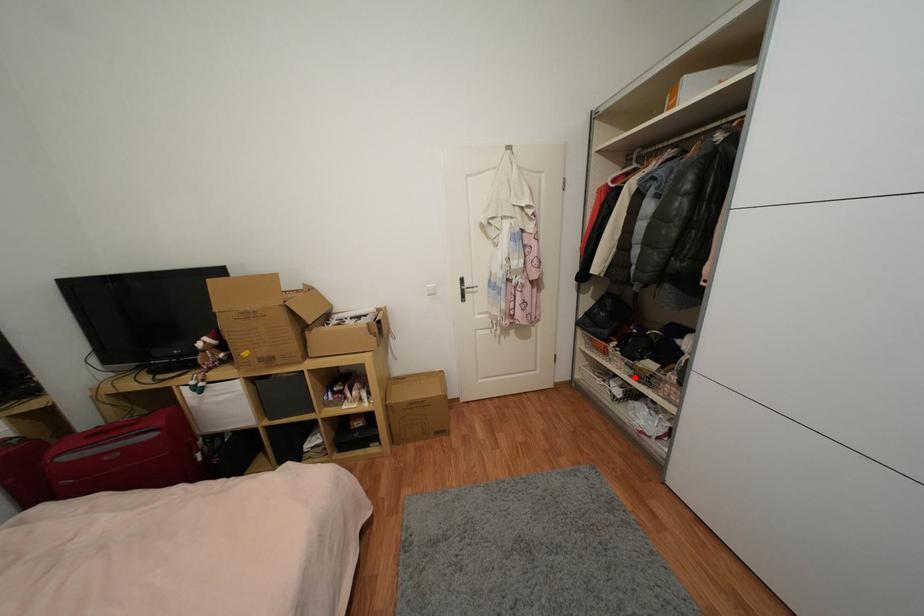
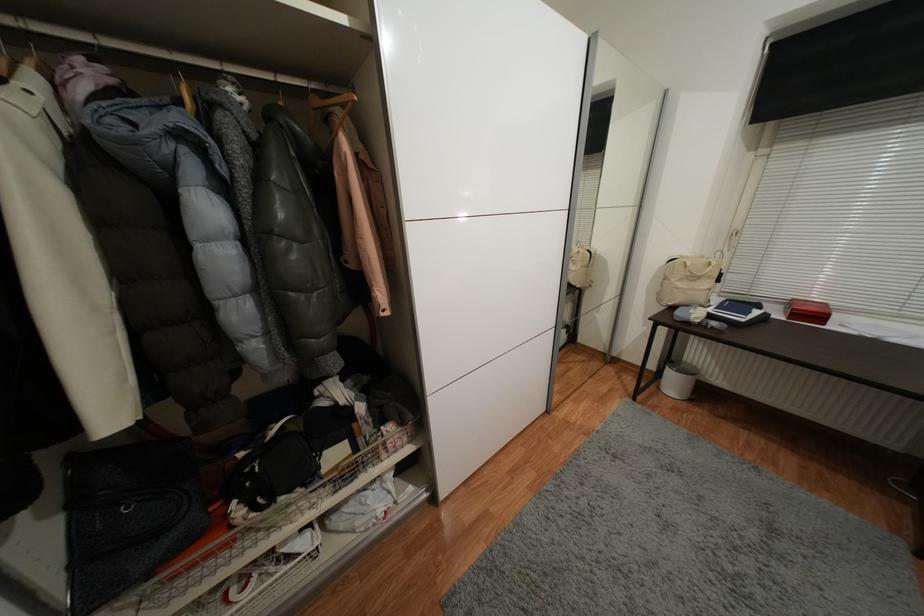
Question: I am providing you with two images of the same scene from different viewpoints. A red point is marked on the first image. Is the red point's position out of view in image 2?

Choices:
 (A) Yes
 (B) No

Answer: (B)